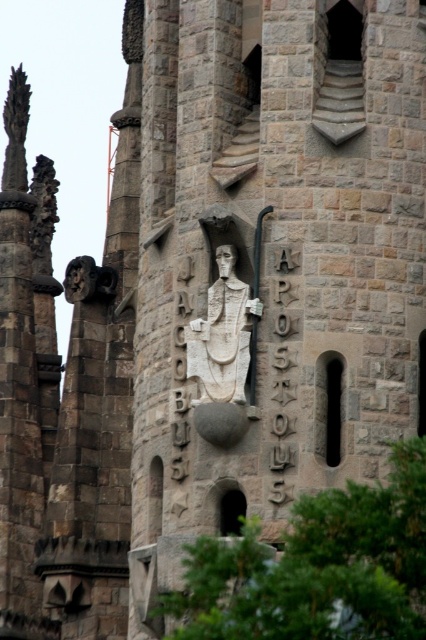
You are an architect examining the stone structure. You notice the white stone statue at center and the white stone face at center. How far apart are these two elements?

The white stone statue at center is 1.50 meters from the white stone face at center.

You are an architect analyzing the stone structure. You notice a point at coordinates (221, 340). What does this point represent in the image?

The point at coordinates (221, 340) corresponds to the white stone statue at center.

What are the coordinates of the matte stone face at upper left?

The coordinates of the matte stone face at upper left are at point (80, 280).